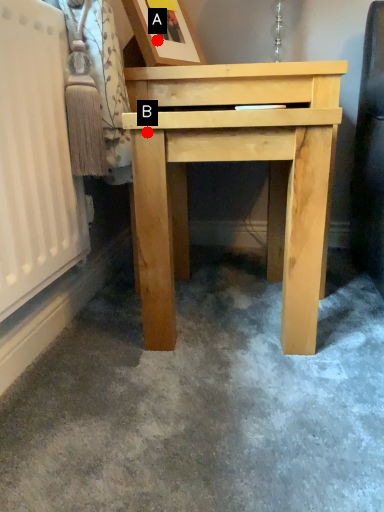
Question: Two points are circled on the image, labeled by A and B beside each circle. Which of the following is the farthest from the observer?

Choices:
 (A) A is further
 (B) B is further

Answer: (A)